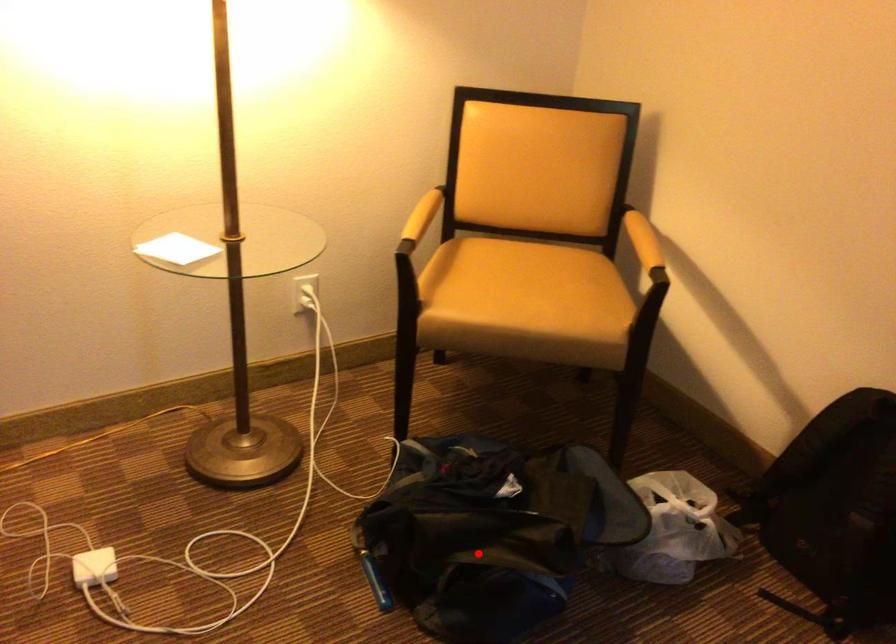
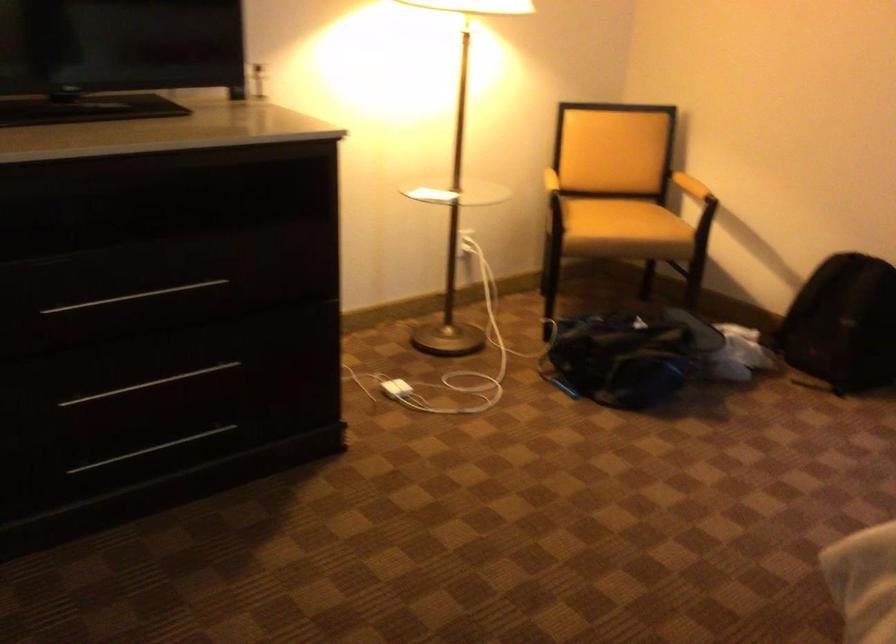
Question: A red point is marked in image1. In image2, is the corresponding 3D point closer to the camera or farther? Reply with the corresponding letter.

Choices:
 (A) The corresponding 3D point is closer.
 (B) The corresponding 3D point is farther.

Answer: (B)